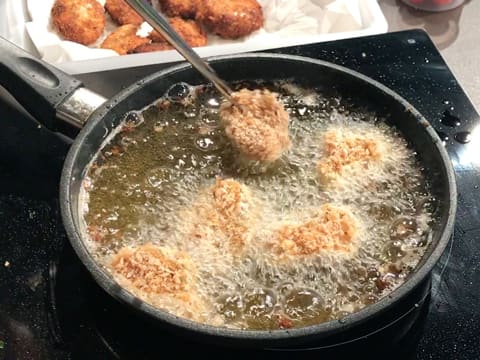
Locate an element on the screen. This screenshot has height=360, width=480. countertop is located at coordinates (456, 36).